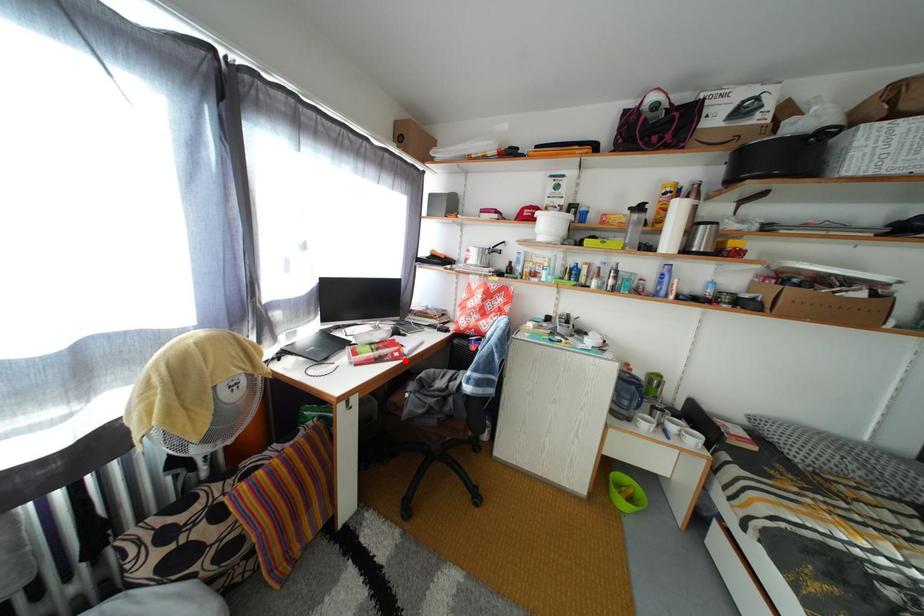
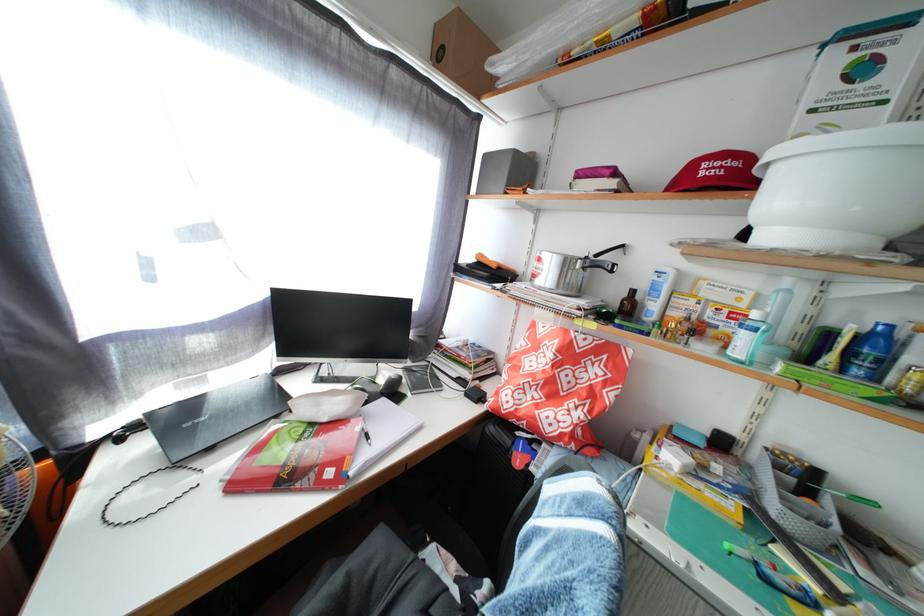
Find the pixel in the second image that matches the highlighted location in the first image.

(338, 480)